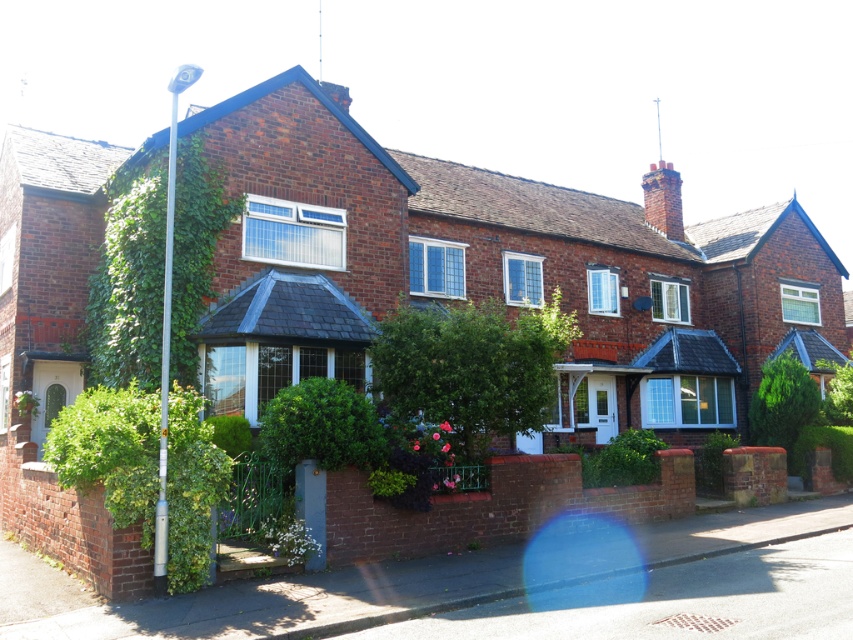
Question: Which point is closer to the camera taking this photo?

Choices:
 (A) (456, 365)
 (B) (190, 250)

Answer: (A)

Question: Is green leafy ivy at center thinner than green leafy ivy at lower left?

Choices:
 (A) no
 (B) yes

Answer: (B)

Question: Does green leafy ivy at left appear under green leafy ivy at lower left?

Choices:
 (A) no
 (B) yes

Answer: (A)

Question: Which point appears closest to the camera in this image?

Choices:
 (A) (144, 528)
 (B) (108, 278)
 (C) (488, 348)

Answer: (A)

Question: Observing the image, what is the correct spatial positioning of green leafy ivy at center in reference to green leafy ivy at lower left?

Choices:
 (A) right
 (B) left

Answer: (A)

Question: Estimate the real-world distances between objects in this image. Which object is closer to the green leafy ivy at center?

Choices:
 (A) green leafy ivy at left
 (B) green leafy ivy at lower left

Answer: (B)